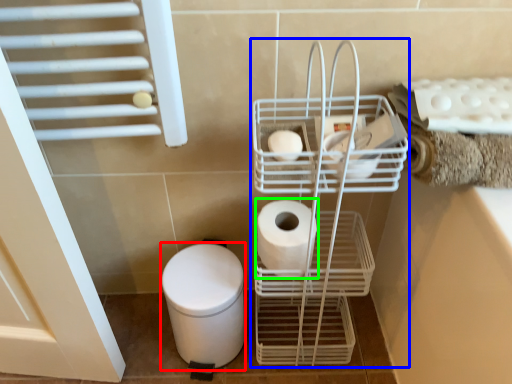
Question: Which object is positioned farthest from bidet (highlighted by a red box)? Select from trolley (highlighted by a blue box) and toilet paper (highlighted by a green box).

Choices:
 (A) trolley
 (B) toilet paper

Answer: (A)